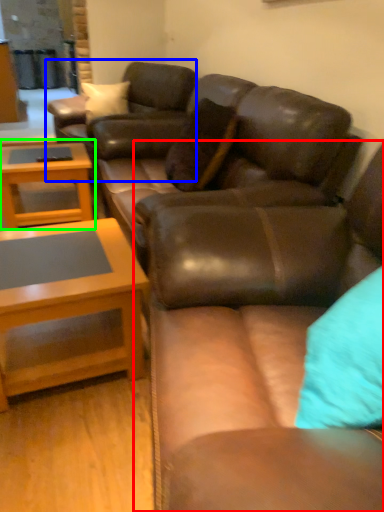
Question: Considering the real-world distances, which object is farthest from studio couch (highlighted by a red box)? swivel chair (highlighted by a blue box) or coffee table (highlighted by a green box)?

Choices:
 (A) swivel chair
 (B) coffee table

Answer: (A)